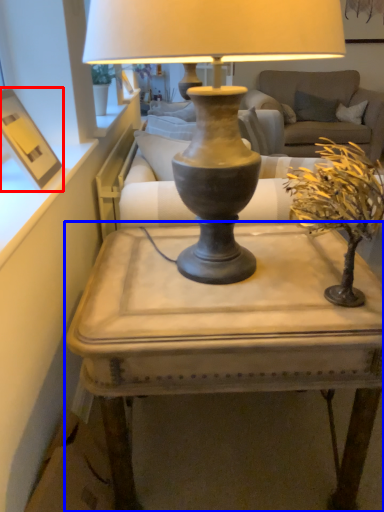
Question: Which object appears farthest to the camera in this image, picture frame (highlighted by a red box) or table (highlighted by a blue box)?

Choices:
 (A) picture frame
 (B) table

Answer: (A)